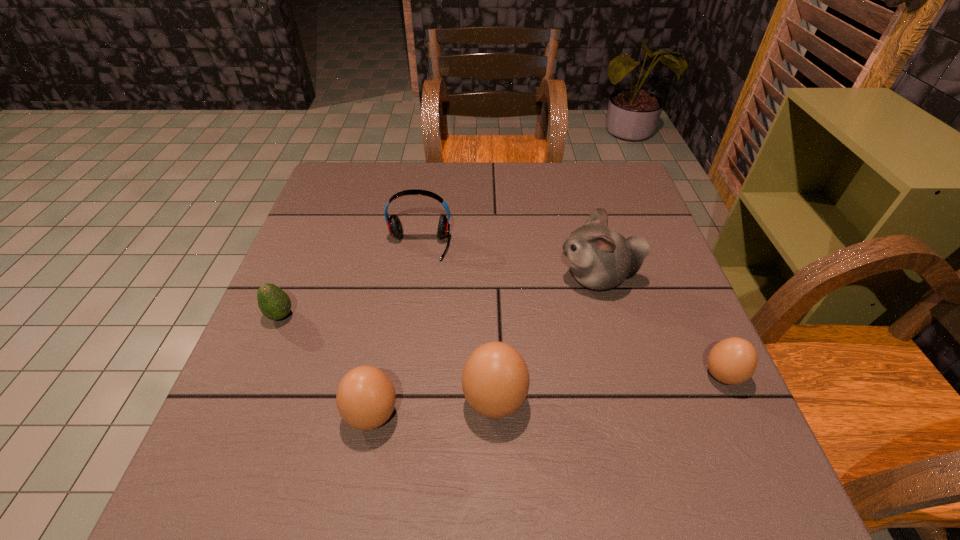
Locate an element on the screen. The image size is (960, 540). free spot between the second tallest boiled egg and the second boiled egg from left to right is located at coordinates (433, 408).

I want to click on vacant area between the second tallest boiled egg and the rightmost object, so click(x=547, y=395).

At what (x,y) coordinates should I click in order to perform the action: click on vacant space that is in between the headset and the leftmost boiled egg. Please return your answer as a coordinate pair (x, y). Looking at the image, I should click on (396, 330).

Find the location of a particular element. vacant region between the avocado and the second shortest boiled egg is located at coordinates (326, 366).

I want to click on vacant space that's between the third object from right to left and the hamster, so click(546, 340).

Locate an element on the screen. vacant area that lies between the leftmost object and the second shortest boiled egg is located at coordinates (326, 366).

Locate which object ranks fourth in proximity to the fifth object from left to right. Please provide its 2D coordinates. Your answer should be formatted as a tuple, i.e. [(x, y)], where the tuple contains the x and y coordinates of a point satisfying the conditions above.

[(365, 398)]

Image resolution: width=960 pixels, height=540 pixels. I want to click on object that is the fifth closest to the shortest boiled egg, so click(274, 303).

Identify the location of boiled egg that is the second closest to the leftmost object. (495, 380).

Locate which boiled egg ranks in proximity to the leftmost boiled egg. Please provide its 2D coordinates. Your answer should be formatted as a tuple, i.e. [(x, y)], where the tuple contains the x and y coordinates of a point satisfying the conditions above.

[(495, 380)]